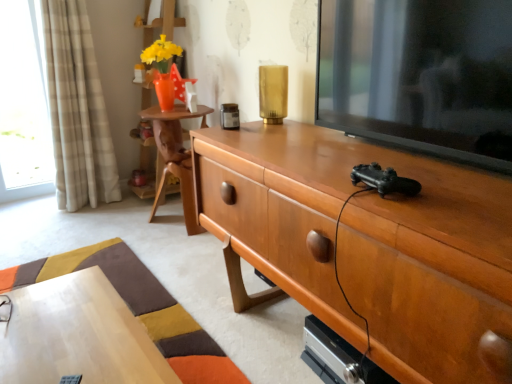
Find the location of a particular element. empty space that is in between beige plaid curtain at left and wooden cabinet at center is located at coordinates (157, 256).